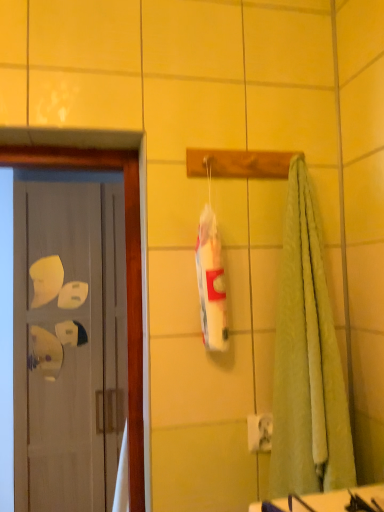
Describe the element at coordinates (126, 272) in the screenshot. I see `white glossy door at left` at that location.

Where is `white glossy door at left`? white glossy door at left is located at coordinates (126, 272).

What is the approximate width of white glossy door at left?

white glossy door at left is 19.07 inches in width.

This screenshot has width=384, height=512. What are the coordinates of `white glossy counter top at lower right` in the screenshot? It's located at [327, 501].

Image resolution: width=384 pixels, height=512 pixels. What do you see at coordinates (327, 501) in the screenshot?
I see `white glossy counter top at lower right` at bounding box center [327, 501].

At what (x,y) coordinates should I click in order to perform the action: click on white glossy door at left. Please return your answer as a coordinate pair (x, y). The image size is (384, 512). Looking at the image, I should click on (126, 272).

Is white glossy door at left to the left of white glossy counter top at lower right from the viewer's perspective?

Yes, white glossy door at left is to the left of white glossy counter top at lower right.

Between white glossy door at left and white glossy counter top at lower right, which one is positioned in front?

Positioned in front is white glossy counter top at lower right.

Is point (101, 155) closer to viewer compared to point (353, 492)?

No, it is not.

From the image's perspective, which is below, white glossy door at left or white glossy counter top at lower right?

white glossy door at left appears lower in the image.

From a real-world perspective, is white glossy door at left physically located above or below white glossy counter top at lower right?

From a real-world perspective, white glossy door at left is physically below white glossy counter top at lower right.

Consider the image. Considering the sizes of white glossy door at left and white glossy counter top at lower right in the image, is white glossy door at left wider or thinner than white glossy counter top at lower right?

Clearly, white glossy door at left has more width compared to white glossy counter top at lower right.

Considering the sizes of objects white glossy door at left and white glossy counter top at lower right in the image provided, who is taller, white glossy door at left or white glossy counter top at lower right?

white glossy door at left is taller.

Who is smaller, white glossy door at left or white glossy counter top at lower right?

Smaller between the two is white glossy counter top at lower right.

Is white glossy door at left situated inside white glossy counter top at lower right or outside?

white glossy door at left cannot be found inside white glossy counter top at lower right.

Does white glossy door at left touch white glossy counter top at lower right?

They are not placed beside each other.

Is white glossy door at left facing away from white glossy counter top at lower right?

No, white glossy counter top at lower right is not at the back of white glossy door at left.

Identify the location of door behind the white glossy counter top at lower right. (126, 272).

Can you confirm if white glossy counter top at lower right is positioned to the right of white glossy door at left?

Yes.

Does white glossy counter top at lower right come in front of white glossy door at left?

Yes.

Does point (362, 488) come farther from viewer compared to point (131, 458)?

No, it is in front of (131, 458).

From the image's perspective, which one is positioned lower, white glossy counter top at lower right or white glossy door at left?

white glossy door at left appears lower in the image.

Based on the photo, from a real-world perspective, who is located lower, white glossy counter top at lower right or white glossy door at left?

white glossy door at left is physically lower.

Is white glossy counter top at lower right wider than white glossy door at left?

Incorrect, the width of white glossy counter top at lower right does not surpass that of white glossy door at left.

Between white glossy counter top at lower right and white glossy door at left, which one has more height?

white glossy door at left is taller.

Which of these two, white glossy counter top at lower right or white glossy door at left, is smaller?

With smaller size is white glossy counter top at lower right.

Is white glossy door at left surrounded by white glossy counter top at lower right?

No.

Is there a large distance between white glossy counter top at lower right and white glossy door at left?

That's not correct — white glossy counter top at lower right is a little close to white glossy door at left.

Is white glossy counter top at lower right oriented towards white glossy door at left?

No, white glossy counter top at lower right does not turn towards white glossy door at left.

From the picture: Measure the distance between white glossy counter top at lower right and white glossy door at left.

21.08 inches.

Find the location of `counter top lying in front of the white glossy door at left`. counter top lying in front of the white glossy door at left is located at coordinates (327, 501).

The image size is (384, 512). I want to click on counter top above the white glossy door at left (from a real-world perspective), so click(327, 501).

The image size is (384, 512). Identify the location of counter top that appears in front of the white glossy door at left. (327, 501).